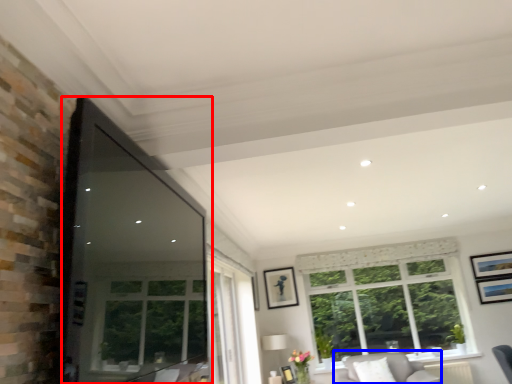
Question: Which object is closer to the camera taking this photo, window screen (highlighted by a red box) or couch (highlighted by a blue box)?

Choices:
 (A) window screen
 (B) couch

Answer: (A)